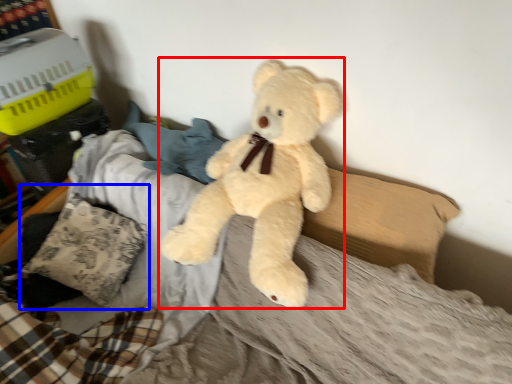
Question: Which point is further to the camera, teddy bear (highlighted by a red box) or pillow (highlighted by a blue box)?

Choices:
 (A) teddy bear
 (B) pillow

Answer: (B)